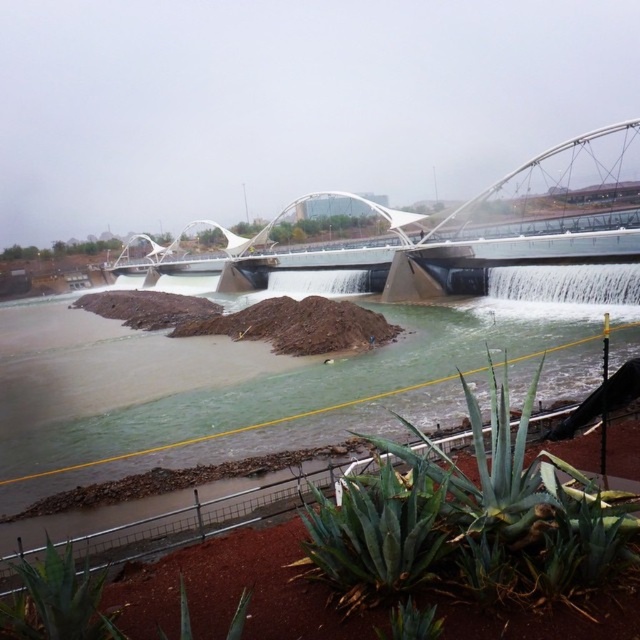
Is point (449, 506) less distant than point (401, 618)?

No.

Which of these two, green spiky plant at lower center or green succulent at lower center, stands shorter?

green succulent at lower center is shorter.

Describe the element at coordinates (468, 522) in the screenshot. The width and height of the screenshot is (640, 640). I see `green spiky plant at lower center` at that location.

Where is `green spiky plant at lower center`? green spiky plant at lower center is located at coordinates (468, 522).

Is brown sediment at center positioned before green leafy plant at lower left?

That is False.

Does brown sediment at center appear over green leafy plant at lower left?

Yes.

Identify the location of brown sediment at center. (276, 378).

This screenshot has height=640, width=640. What are the coordinates of `brown sediment at center` in the screenshot? It's located at (276, 378).

Find the location of a particular element. This screenshot has width=640, height=640. brown sediment at center is located at coordinates (276, 378).

Does point (64, 369) come closer to viewer compared to point (390, 620)?

No, (64, 369) is behind (390, 620).

Where is `brown sediment at center`? This screenshot has width=640, height=640. brown sediment at center is located at coordinates (276, 378).